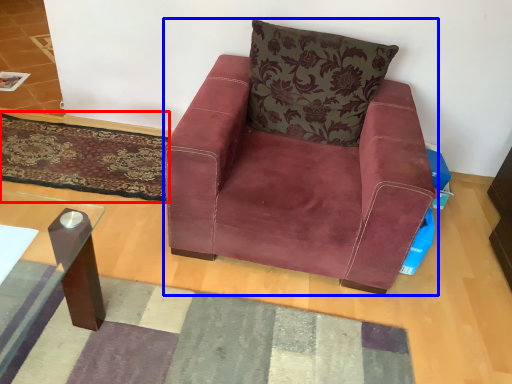
Question: Which object is closer to the camera taking this photo, mat (highlighted by a red box) or chair (highlighted by a blue box)?

Choices:
 (A) mat
 (B) chair

Answer: (B)